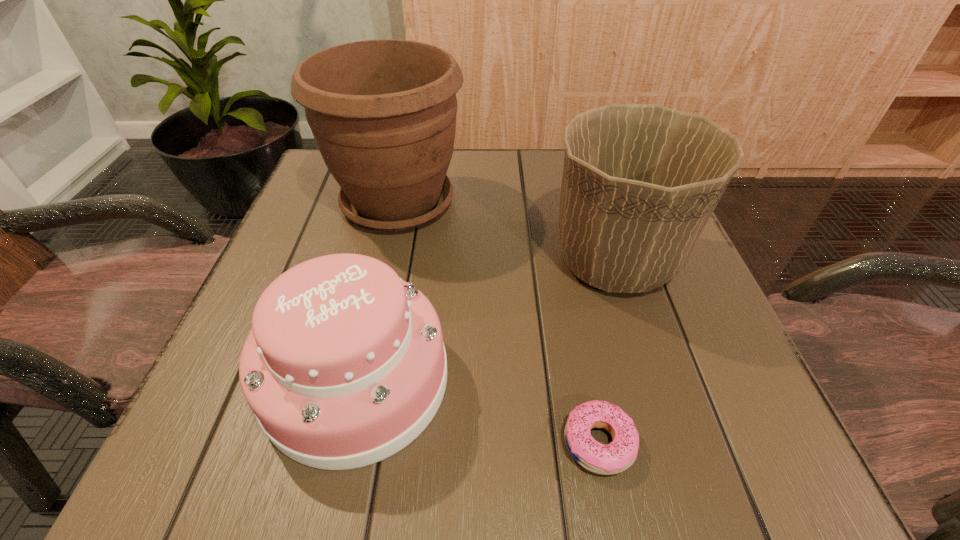
You are a GUI agent. You are given a task and a screenshot of the screen. Output one action in this format:
    pyautogui.click(x=<x>, y=<y>)
    Task: Click on the free space at the near right corner of the desktop
    
    Given the screenshot: What is the action you would take?
    point(762,436)

Locate an element on the screen. The image size is (960, 540). vacant area between the left flowerpot and the doughnut is located at coordinates (498, 322).

Identify the location of vacant area between the shorter flowerpot and the shortest object. This screenshot has width=960, height=540. (608, 351).

Locate an element on the screen. The width and height of the screenshot is (960, 540). free space between the right flowerpot and the second shortest object is located at coordinates (487, 320).

You are a GUI agent. You are given a task and a screenshot of the screen. Output one action in this format:
    pyautogui.click(x=<x>, y=<y>)
    Task: Click on the empty location between the shortest object and the shorter flowerpot
    The width and height of the screenshot is (960, 540).
    Given the screenshot: What is the action you would take?
    pyautogui.click(x=608, y=351)

Identify the location of free space between the left flowerpot and the shorter flowerpot. (507, 231).

Locate an element on the screen. This screenshot has width=960, height=540. vacant area that lies between the shortest object and the third tallest object is located at coordinates (478, 411).

At what (x,y) coordinates should I click in order to perform the action: click on free spot between the doughnut and the right flowerpot. Please return your answer as a coordinate pair (x, y). Looking at the image, I should click on (608, 351).

Identify the location of vacant area between the cake and the shorter flowerpot. (487, 320).

Where is `unoccupied area between the left flowerpot and the right flowerpot`? The height and width of the screenshot is (540, 960). unoccupied area between the left flowerpot and the right flowerpot is located at coordinates (507, 231).